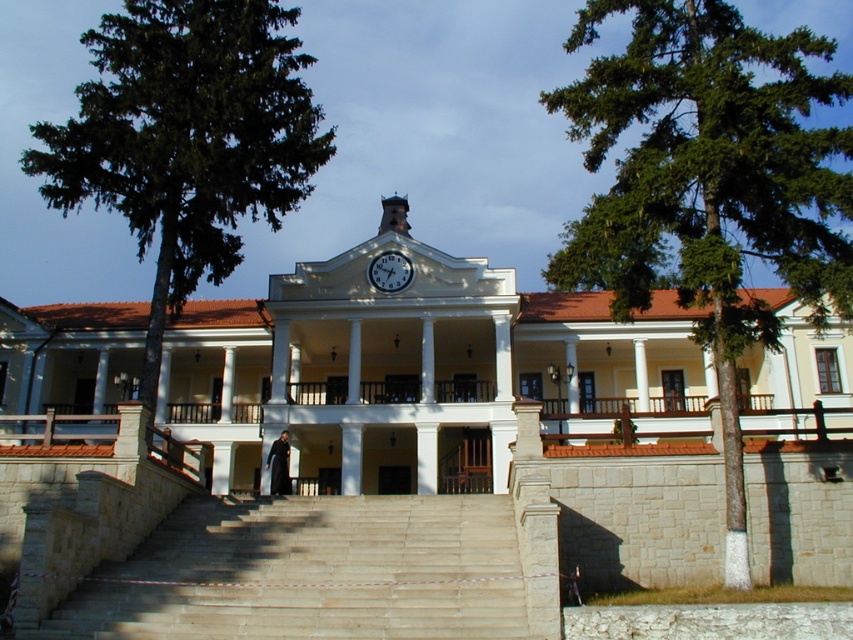
You are standing at the bottom of the light beige stone stairs at center and want to reach the person standing near the top. Is the green leafy tree at center blocking your path to the stairs?

The light beige stone stairs at center is behind the green leafy tree at center, so the tree is blocking your path to the stairs.

You are standing at the entrance of the grand classical building and want to locate a specific point marked as point (186, 138). Based on the scene, where would this point be located?

The point (186, 138) is located on the green leafy tree at left.

You are standing at the bottom of the light beige stone stairs at center, looking up towards the green leafy tree at center. Which object is taller?

The green leafy tree at center is taller than the light beige stone stairs at center.